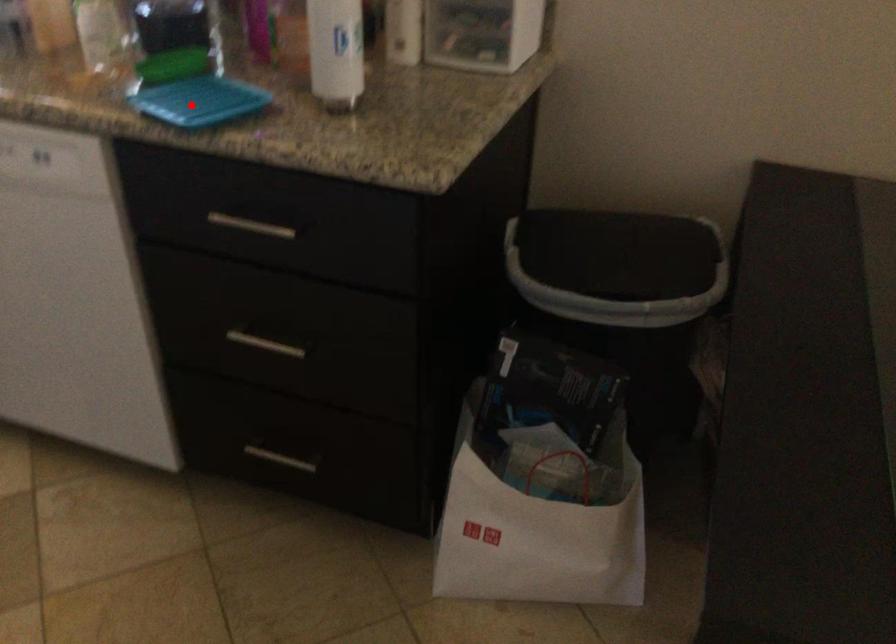
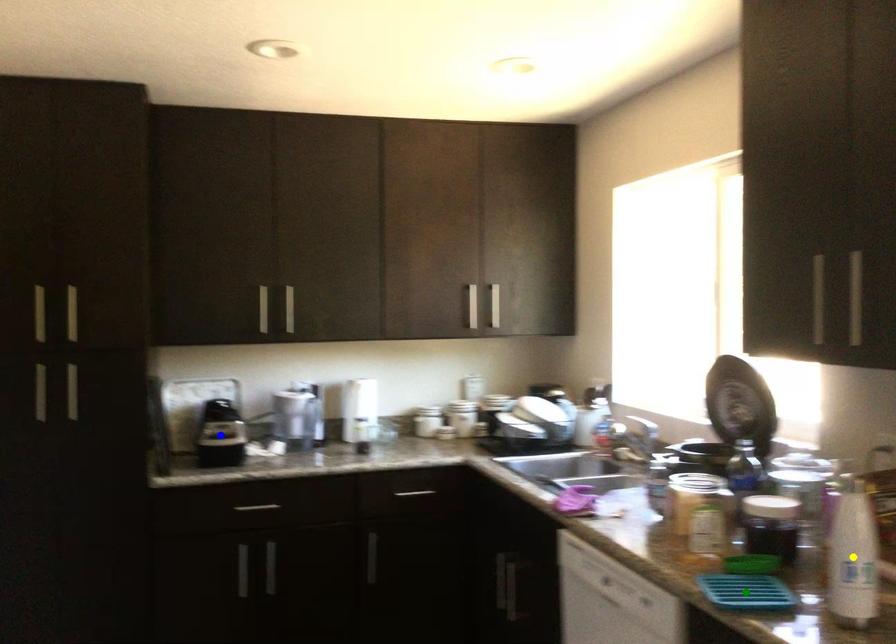
Question: I am providing you with two images of the same scene from different viewpoints. A red point is marked on the first image. You are given multiple points on the second image. Which point in image 2 is actually the same real-world point as the red point in image 1?

Choices:
 (A) yellow point
 (B) green point
 (C) blue point

Answer: (B)